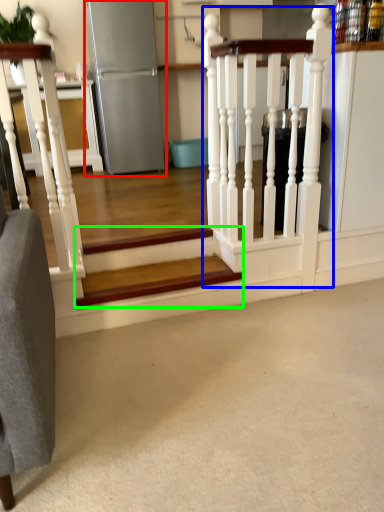
Question: Which object is positioned closest to appliance (highlighted by a red box)? Select from rail (highlighted by a blue box) and stairs (highlighted by a green box).

Choices:
 (A) rail
 (B) stairs

Answer: (A)